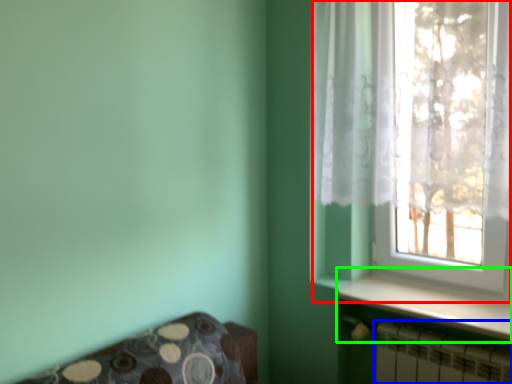
Question: Estimate the real-world distances between objects in this image. Which object is closer to window (highlighted by a red box), radiator (highlighted by a blue box) or window sill (highlighted by a green box)?

Choices:
 (A) radiator
 (B) window sill

Answer: (B)